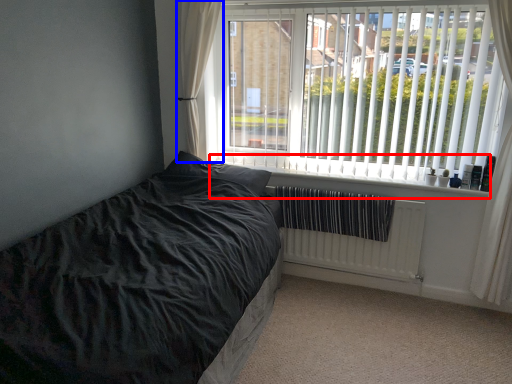
Question: Which object appears closest to the camera in this image, window sill (highlighted by a red box) or curtain (highlighted by a blue box)?

Choices:
 (A) window sill
 (B) curtain

Answer: (A)